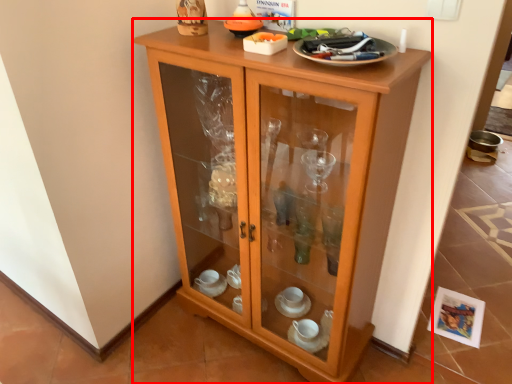
Question: In this image, where is cupboard (annotated by the red box) located relative to tableware?

Choices:
 (A) right
 (B) left

Answer: (B)